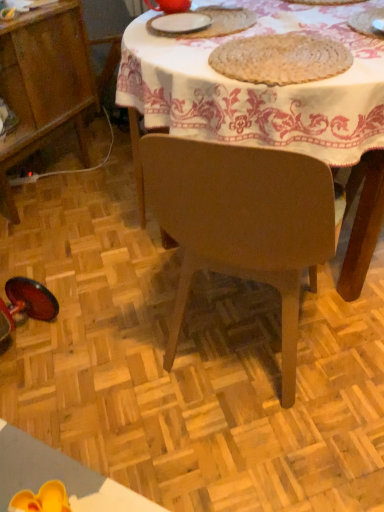
In order to click on free point behind white matte plate at upper center, the 2th tableware in the left-to-right sequence in this screenshot , I will do `click(199, 11)`.